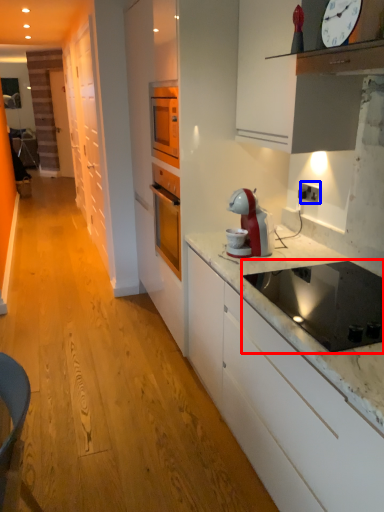
Question: Which of the following is the farthest to the observer, kitchen appliance (highlighted by a red box) or electric outlet (highlighted by a blue box)?

Choices:
 (A) kitchen appliance
 (B) electric outlet

Answer: (B)